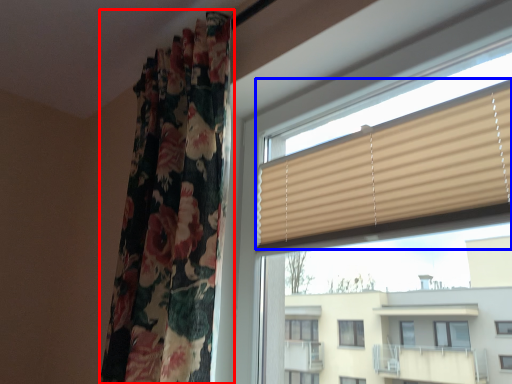
Question: Which point is further to the camera, curtain (highlighted by a red box) or window blind (highlighted by a blue box)?

Choices:
 (A) curtain
 (B) window blind

Answer: (A)